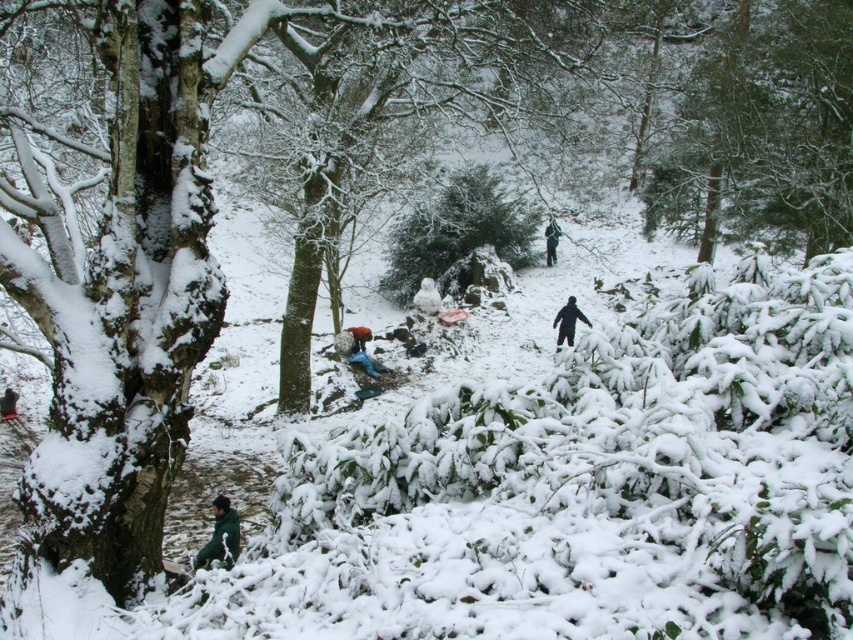
Can you confirm if green textured bush at center is thinner than dark green jacket at lower left?

In fact, green textured bush at center might be wider than dark green jacket at lower left.

Where is `green textured bush at center`? This screenshot has width=853, height=640. green textured bush at center is located at coordinates (457, 230).

What do you see at coordinates (457, 230) in the screenshot? I see `green textured bush at center` at bounding box center [457, 230].

Identify the location of green textured bush at center. (457, 230).

Between black matte snowsuit at center and black matte person at center-right, which one is positioned lower?

black matte snowsuit at center is lower down.

Which is in front, point (570, 321) or point (547, 227)?

Point (570, 321) is in front.

This screenshot has height=640, width=853. What are the coordinates of `black matte snowsuit at center` in the screenshot? It's located at (567, 321).

Consider the image. Is green textured bush at center smaller than black matte person at center-right?

Yes, green textured bush at center is smaller than black matte person at center-right.

Who is positioned more to the left, green textured bush at center or black matte person at center-right?

green textured bush at center

Is point (473, 225) closer to viewer compared to point (548, 248)?

Yes.

Where is `green textured bush at center`? green textured bush at center is located at coordinates (457, 230).